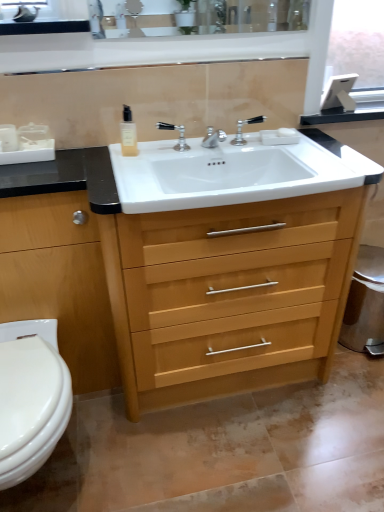
The image size is (384, 512). In order to click on vacant area that lies between light wood/wooden vanity at center and white glossy toilet at lower left in this screenshot , I will do (x=194, y=443).